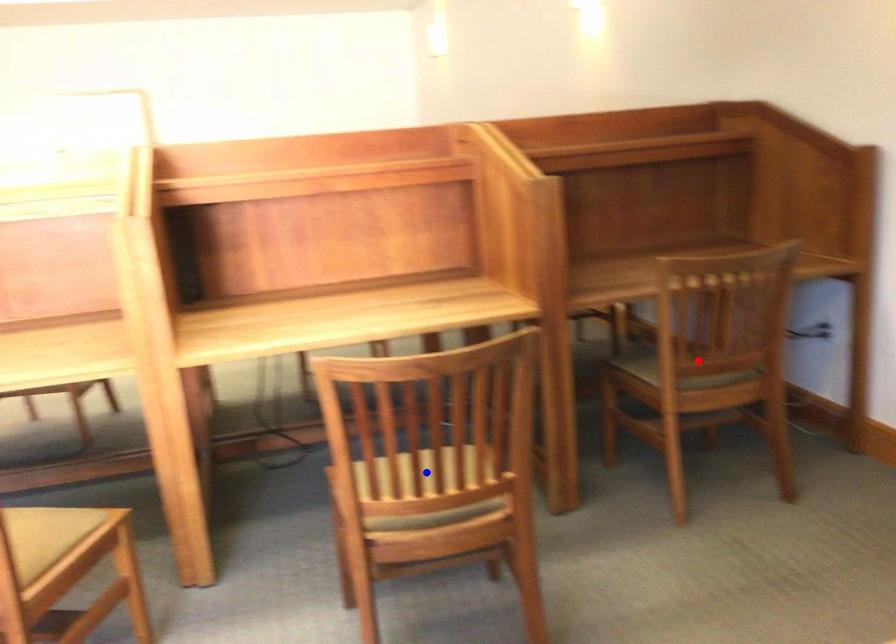
Question: Two points are marked on the image. Which point is closer to the camera?

Choices:
 (A) Blue point is closer.
 (B) Red point is closer.

Answer: (A)